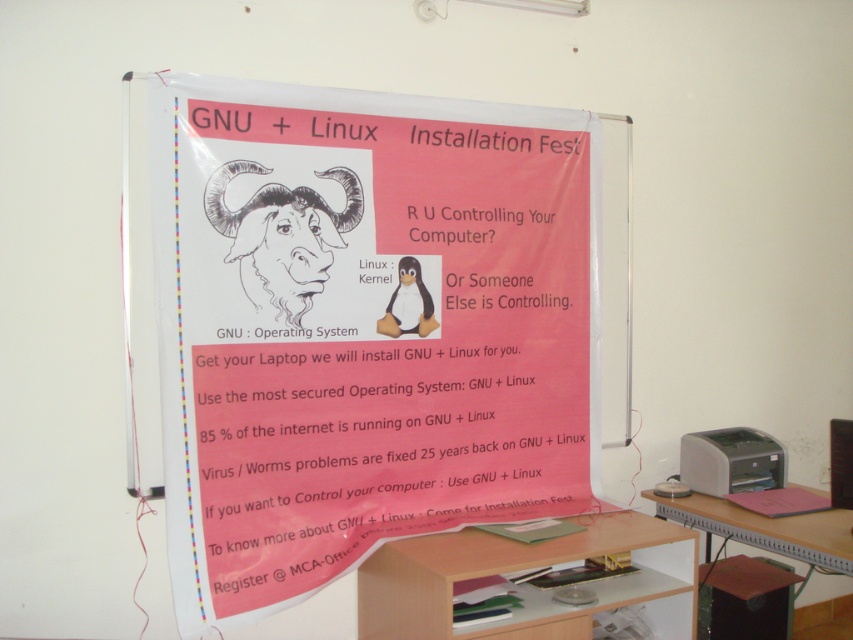
Who is more distant from viewer, (616, 592) or (743, 467)?

Point (743, 467)

Is brown wood computer desk at center to the left of white plastic printer at lower right from the viewer's perspective?

Correct, you'll find brown wood computer desk at center to the left of white plastic printer at lower right.

Is point (630, 531) more distant than point (746, 449)?

No.

Locate an element on the screen. brown wood computer desk at center is located at coordinates (527, 584).

Which is above, pink paper poster at center or white plastic printer at lower right?

pink paper poster at center

Which is more to the left, pink paper poster at center or white plastic printer at lower right?

pink paper poster at center

Is point (563, 236) closer to viewer compared to point (735, 477)?

Yes, it is in front of point (735, 477).

Locate an element on the screen. This screenshot has width=853, height=640. pink paper poster at center is located at coordinates (366, 336).

Is brown wood computer desk at center wider than black line drawing goat at center?

Correct, the width of brown wood computer desk at center exceeds that of black line drawing goat at center.

Identify the location of brown wood computer desk at center. (527, 584).